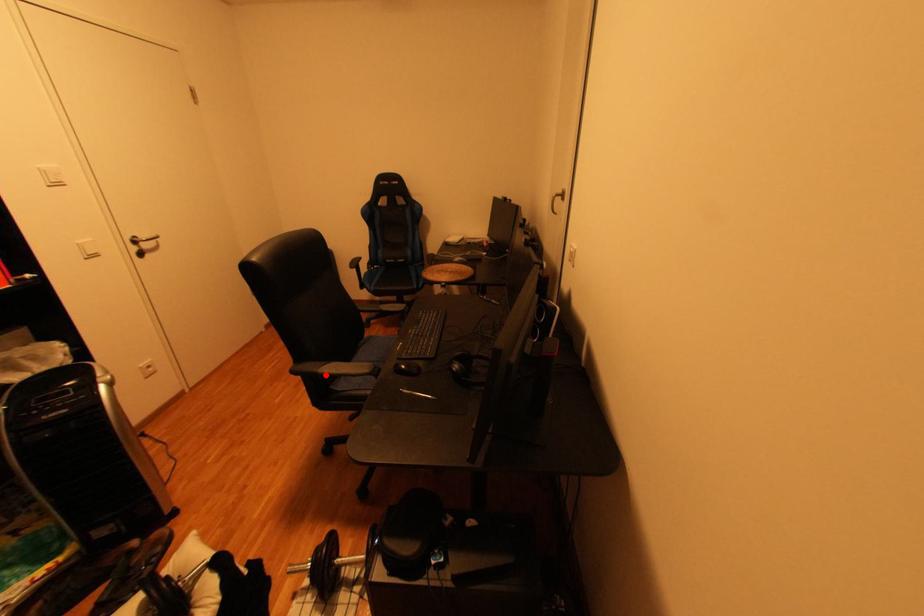
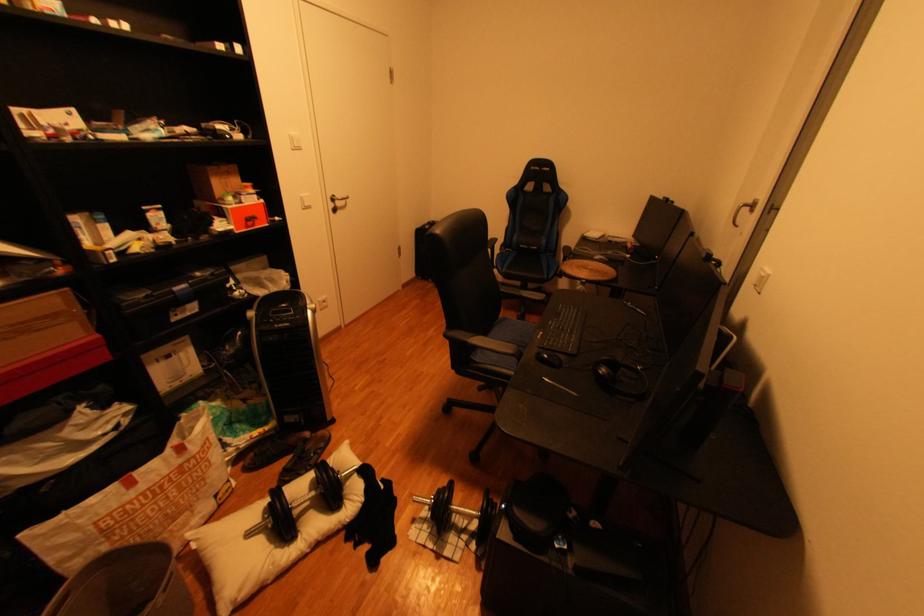
Locate, in the second image, the point that corresponds to the highlighted location in the first image.

(477, 344)